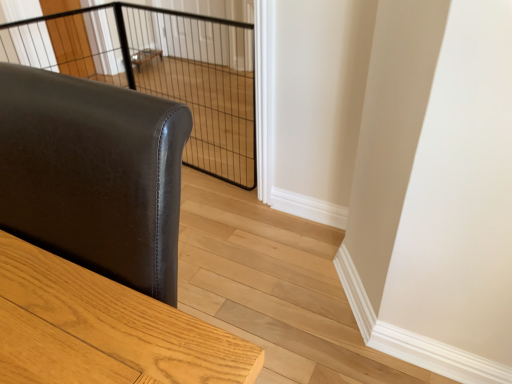
Question: Considering the relative sizes of matte black leather sofa at left and clear wire mesh at upper left, marked as the 2th screen door in a right-to-left arrangement, in the image provided, is matte black leather sofa at left thinner than clear wire mesh at upper left, marked as the 2th screen door in a right-to-left arrangement,?

Choices:
 (A) yes
 (B) no

Answer: (B)

Question: From a real-world perspective, is matte black leather sofa at left beneath clear wire mesh at upper left, marked as the 2th screen door in a right-to-left arrangement?

Choices:
 (A) no
 (B) yes

Answer: (A)

Question: Is matte black leather sofa at left wider than clear wire mesh at upper left, which ranks as the first screen door in left-to-right order?

Choices:
 (A) yes
 (B) no

Answer: (A)

Question: From the image's perspective, does matte black leather sofa at left appear lower than clear wire mesh at upper left, marked as the 2th screen door in a right-to-left arrangement?

Choices:
 (A) yes
 (B) no

Answer: (A)

Question: Is matte black leather sofa at left with clear wire mesh at upper left, which ranks as the first screen door in left-to-right order?

Choices:
 (A) no
 (B) yes

Answer: (A)

Question: From a real-world perspective, relative to clear wire mesh at upper left, marked as the 2th screen door in a right-to-left arrangement, is black wire mesh cage at upper center vertically above or below?

Choices:
 (A) above
 (B) below

Answer: (A)

Question: In terms of width, does black wire mesh cage at upper center look wider or thinner when compared to clear wire mesh at upper left, which ranks as the first screen door in left-to-right order?

Choices:
 (A) wide
 (B) thin

Answer: (A)

Question: Is black wire mesh cage at upper center spatially inside clear wire mesh at upper left, marked as the 2th screen door in a right-to-left arrangement, or outside of it?

Choices:
 (A) outside
 (B) inside

Answer: (A)

Question: From the image's perspective, is black wire mesh cage at upper center above or below clear wire mesh at upper left, which ranks as the first screen door in left-to-right order?

Choices:
 (A) above
 (B) below

Answer: (B)

Question: Looking at the image, does matte black leather sofa at left seem bigger or smaller compared to clear glass screen door at upper center, marked as the 2th screen door in a left-to-right arrangement?

Choices:
 (A) small
 (B) big

Answer: (B)

Question: From a real-world perspective, is matte black leather sofa at left above or below clear glass screen door at upper center, which is the 1th screen door in right-to-left order?

Choices:
 (A) above
 (B) below

Answer: (A)

Question: From the image's perspective, is matte black leather sofa at left above or below clear glass screen door at upper center, marked as the 2th screen door in a left-to-right arrangement?

Choices:
 (A) above
 (B) below

Answer: (B)

Question: Relative to clear glass screen door at upper center, marked as the 2th screen door in a left-to-right arrangement, is matte black leather sofa at left in front or behind?

Choices:
 (A) front
 (B) behind

Answer: (A)

Question: From the image's perspective, is black wire mesh cage at upper center located above or below matte black leather sofa at left?

Choices:
 (A) above
 (B) below

Answer: (A)

Question: Considering the relative positions of black wire mesh cage at upper center and matte black leather sofa at left in the image provided, is black wire mesh cage at upper center to the left or to the right of matte black leather sofa at left?

Choices:
 (A) right
 (B) left

Answer: (A)